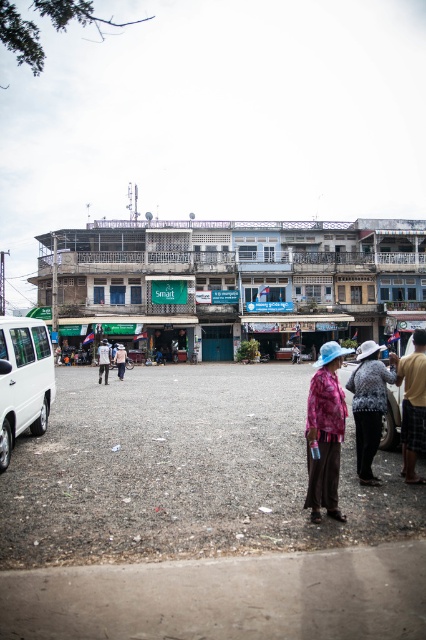
You are standing at the point marked by the coordinates point (x=247, y=278). Based on the scene description, what type of surface are you standing on?

The point (x=247, y=278) is on brown wooden market at center, so you are standing on a brown wooden market surface.

You are a delivery person trying to park your white matte van at lower left in a space that requires vehicles to be shorter than the printed fabric pants at center. Can your van fit?

The white matte van at lower left is not as tall as the printed fabric pants at center, so it can fit in the parking space.

You are standing at the center of the image. Which direction should you walk to reach the white matte van at lower left?

You should walk towards the lower left direction to reach the white matte van at lower left, as it is located at point (23,380) which is lower left in the image coordinate system.